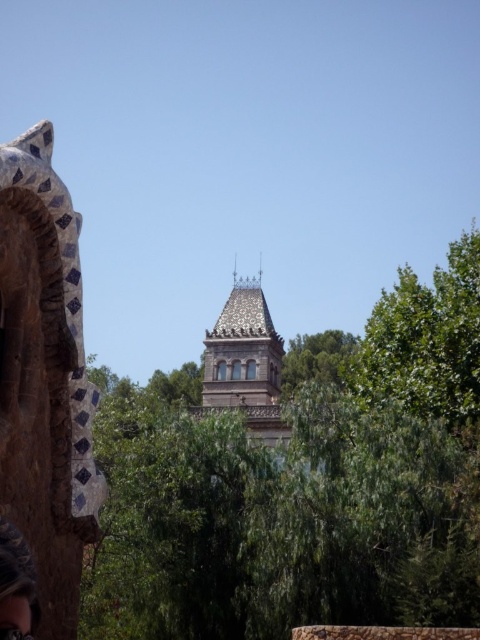
Question: Among these objects, which one is farthest from the camera?

Choices:
 (A) matte black hair at lower left
 (B) polished stone tower at center
 (C) polychrome mosaic dragon head at left

Answer: (B)

Question: Among these objects, which one is farthest from the camera?

Choices:
 (A) green leafy tree at center
 (B) matte black hair at lower left
 (C) polychrome mosaic dragon head at left
 (D) polished stone tower at center

Answer: (D)

Question: Is green leafy tree at center positioned behind polychrome mosaic dragon head at left?

Choices:
 (A) yes
 (B) no

Answer: (A)

Question: Is polychrome mosaic dragon head at left further to the viewer compared to polished stone tower at center?

Choices:
 (A) no
 (B) yes

Answer: (A)

Question: Considering the relative positions of green leafy tree at center and polished stone tower at center in the image provided, where is green leafy tree at center located with respect to polished stone tower at center?

Choices:
 (A) above
 (B) below

Answer: (A)

Question: Which of the following is the farthest from the observer?

Choices:
 (A) coord(28,596)
 (B) coord(59,589)
 (C) coord(328,618)

Answer: (C)